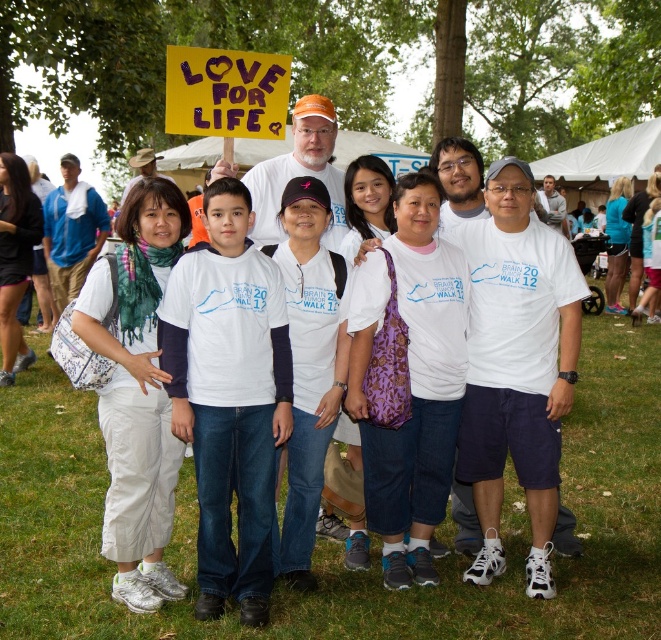
Who is taller, white long-sleeved shirt at center or yellow paper sign at upper center?

white long-sleeved shirt at center is taller.

Is white long-sleeved shirt at center to the left of yellow paper sign at upper center from the viewer's perspective?

In fact, white long-sleeved shirt at center is to the right of yellow paper sign at upper center.

Find the location of `white long-sleeved shirt at center`. white long-sleeved shirt at center is located at coordinates (229, 396).